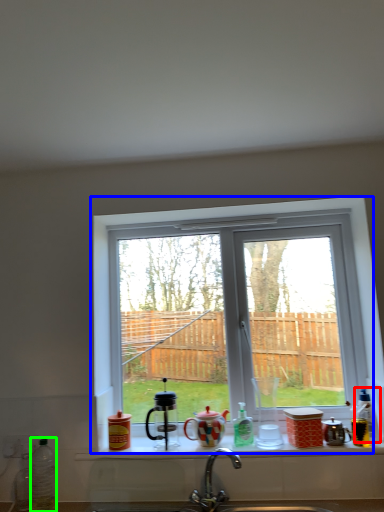
Question: Based on their relative distances, which object is nearer to bottle (highlighted by a red box)? Choose from window (highlighted by a blue box) and bottle (highlighted by a green box).

Choices:
 (A) window
 (B) bottle

Answer: (A)